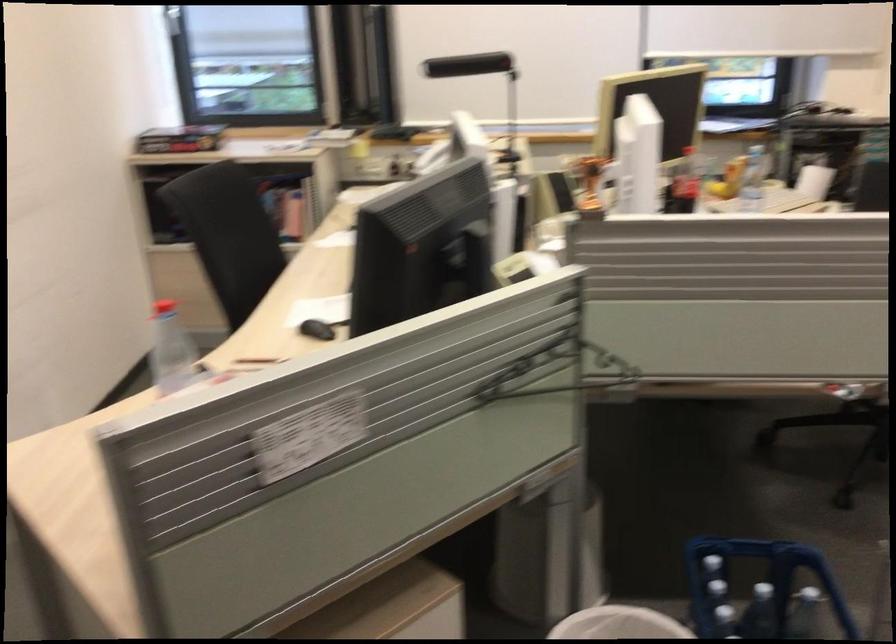
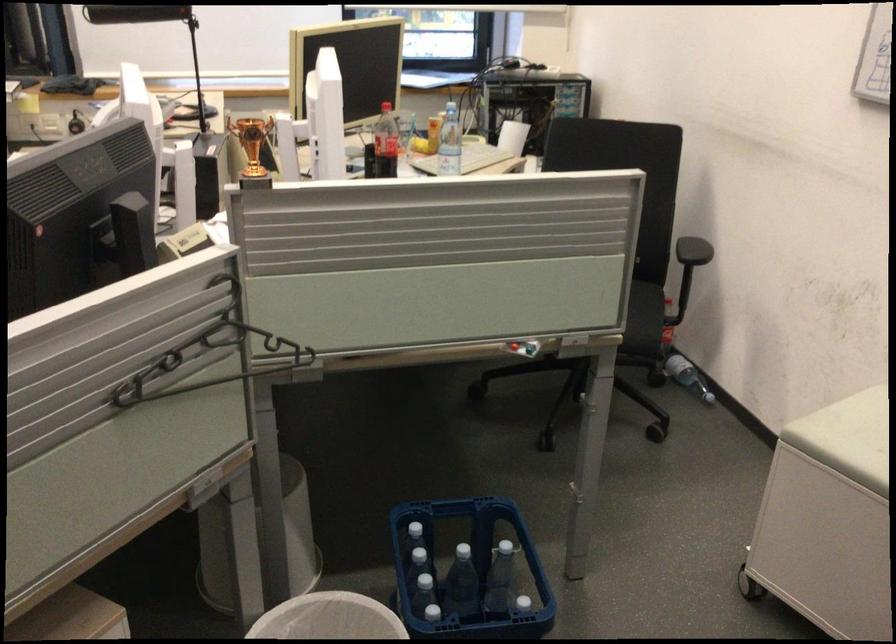
The point at (548, 363) is marked in the first image. Where is the corresponding point in the second image?

(209, 355)